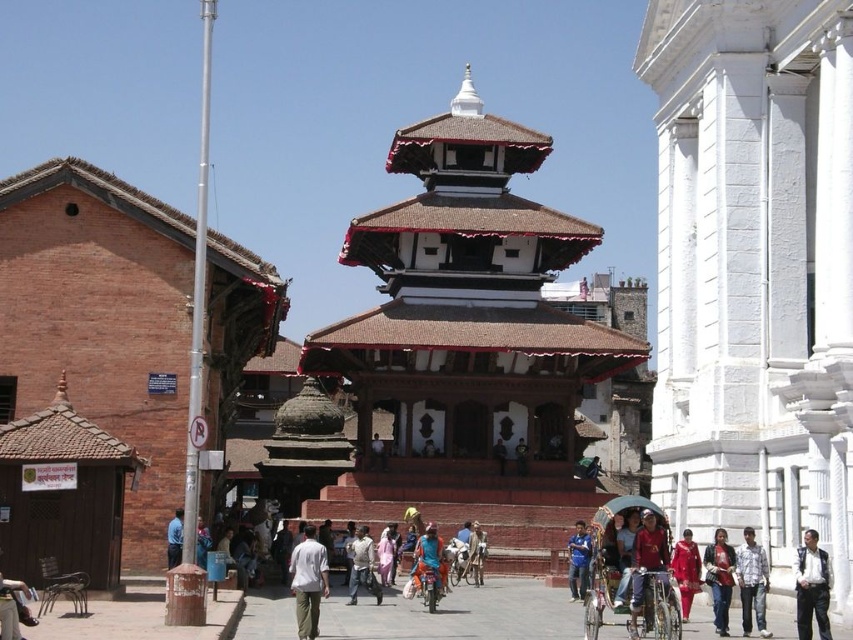
Which is more to the right, light brown leather bag at center or brown leather jacket at center?

brown leather jacket at center

Who is more forward, (4, 609) or (479, 572)?

Positioned in front is point (4, 609).

I want to click on light brown leather bag at center, so click(x=9, y=608).

Between denim jacket at lower right and pink fabric dress at center, which one appears on the left side from the viewer's perspective?

pink fabric dress at center is more to the left.

Looking at this image, who is higher up, denim jacket at lower right or pink fabric dress at center?

Positioned higher is denim jacket at lower right.

Does point (706, 566) come closer to viewer compared to point (389, 579)?

Yes, it is in front of point (389, 579).

Identify the location of denim jacket at lower right. Image resolution: width=853 pixels, height=640 pixels. (718, 577).

How far apart are white cotton shirt at center and denim jeans at center?

A distance of 58.00 feet exists between white cotton shirt at center and denim jeans at center.

At what (x,y) coordinates should I click in order to perform the action: click on white cotton shirt at center. Please return your answer as a coordinate pair (x, y). Image resolution: width=853 pixels, height=640 pixels. Looking at the image, I should click on (308, 580).